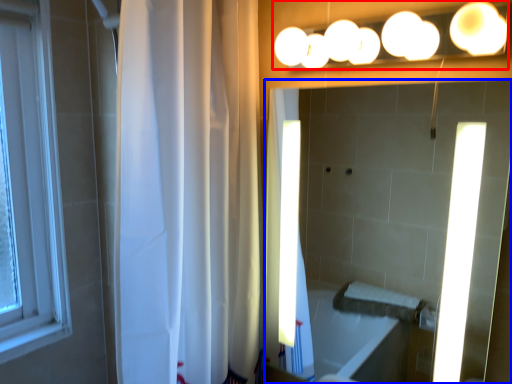
Question: Which of the following is the closest to the observer, fixture (highlighted by a red box) or mirror (highlighted by a blue box)?

Choices:
 (A) fixture
 (B) mirror

Answer: (A)